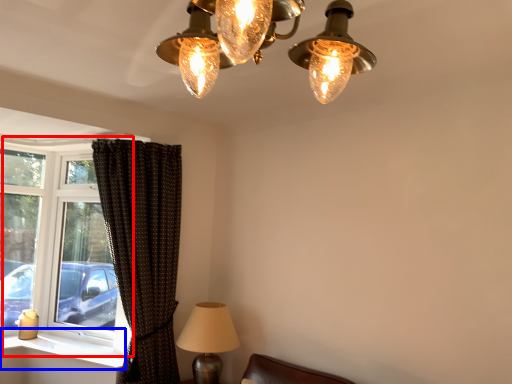
Question: Which point is closer to the camera, window (highlighted by a red box) or window sill (highlighted by a blue box)?

Choices:
 (A) window
 (B) window sill

Answer: (B)